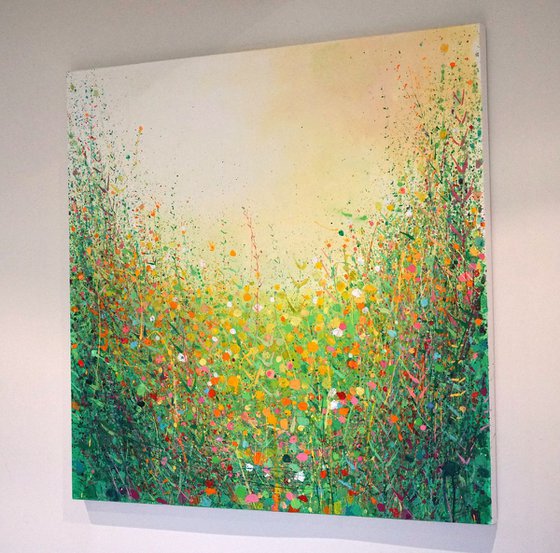
Locate an element on the screen. This screenshot has width=560, height=553. top edge of painting is located at coordinates (253, 50).